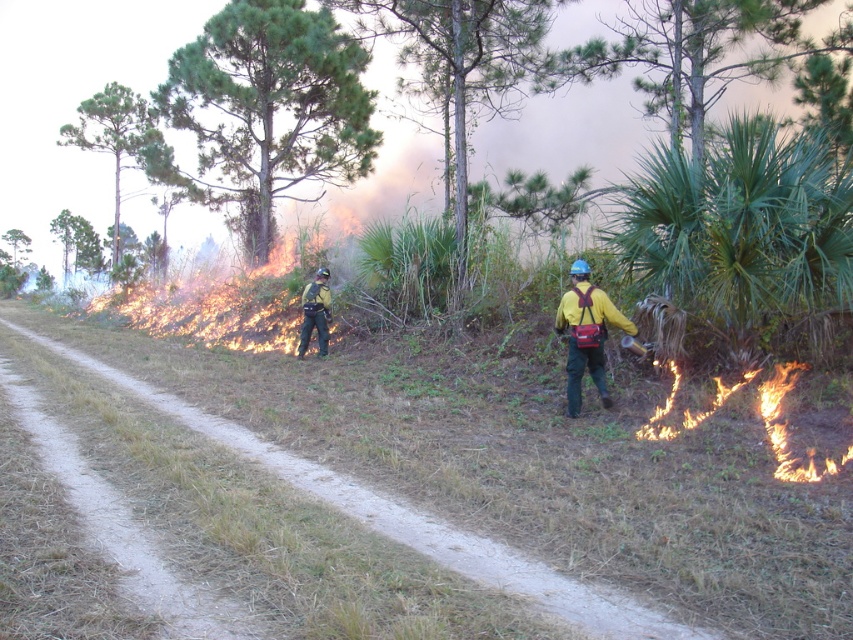
Question: Is yellow matte jacket at right wider than matte black uniform at center?

Choices:
 (A) yes
 (B) no

Answer: (A)

Question: Based on their relative distances, which object is nearer to the yellow matte jacket at right?

Choices:
 (A) brown dirt path at center
 (B) matte black uniform at center

Answer: (A)

Question: Which point appears farthest from the camera in this image?

Choices:
 (A) (317, 323)
 (B) (577, 323)
 (C) (115, 372)

Answer: (A)

Question: Does brown dirt path at center have a larger size compared to yellow matte jacket at right?

Choices:
 (A) no
 (B) yes

Answer: (B)

Question: Which point appears closest to the camera in this image?

Choices:
 (A) coord(305,332)
 (B) coord(611,321)

Answer: (B)

Question: Can you confirm if brown dirt path at center is positioned above matte black uniform at center?

Choices:
 (A) yes
 (B) no

Answer: (B)